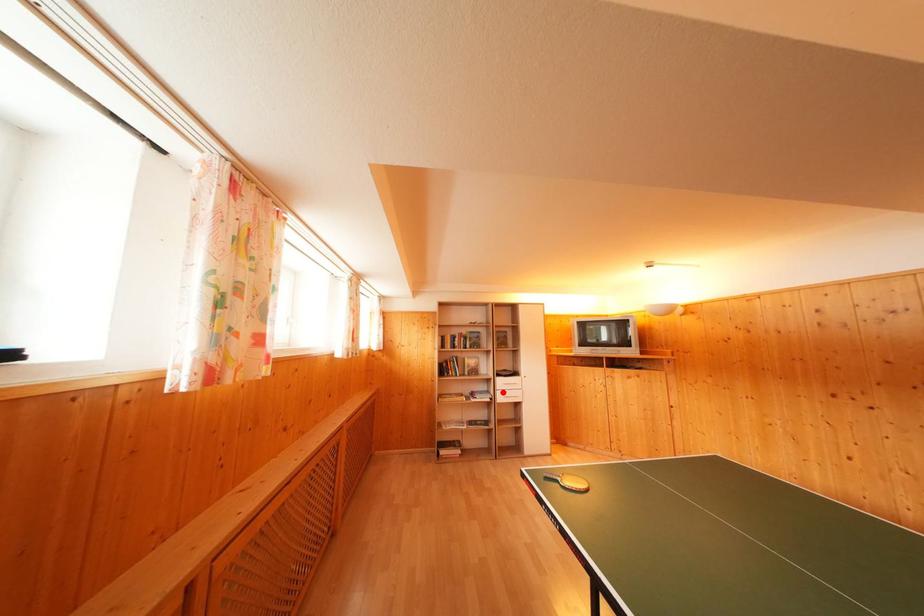
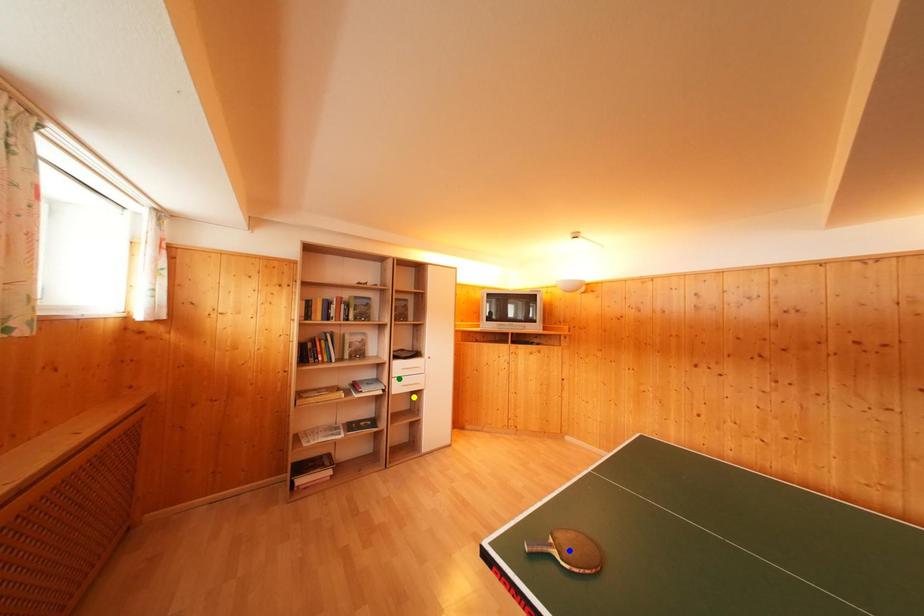
Question: I am providing you with two images of the same scene from different viewpoints. A red point is marked on the first image. You are given multiple points on the second image. Which point in image 2 represents the same 3d spot as the red point in image 1?

Choices:
 (A) yellow point
 (B) blue point
 (C) green point

Answer: (C)